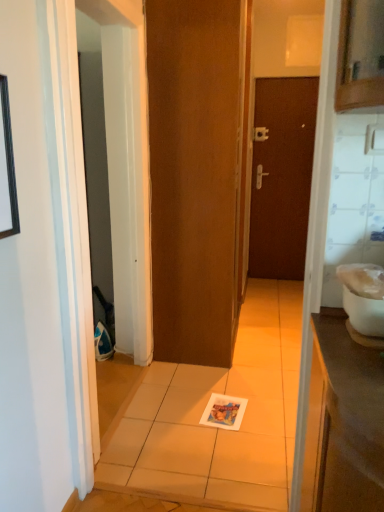
Where is `free space in front of brown matte door at center, placed as the 1th door when sorted from back to front`? free space in front of brown matte door at center, placed as the 1th door when sorted from back to front is located at coordinates (279, 286).